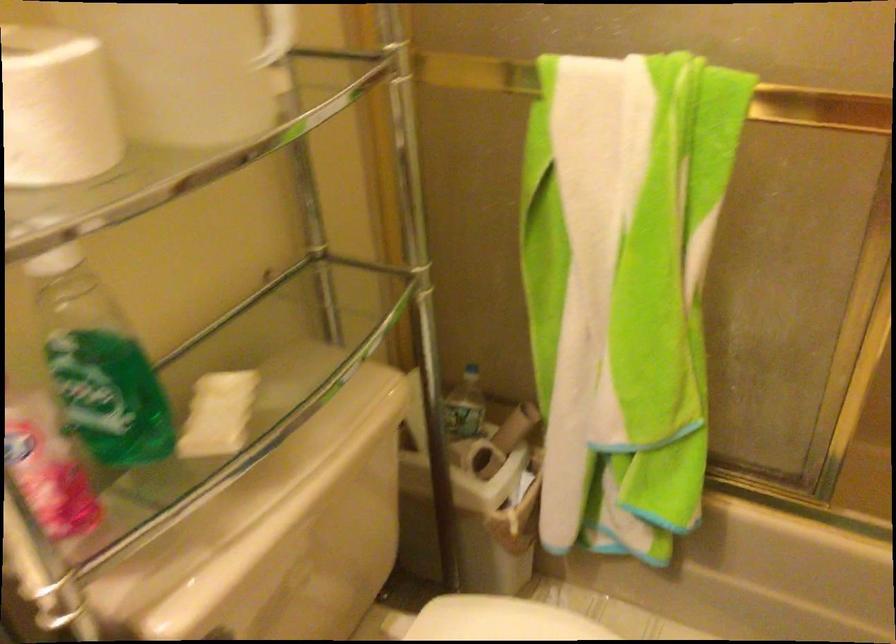
What do you see at coordinates (56, 108) in the screenshot? I see `a white toilet paper` at bounding box center [56, 108].